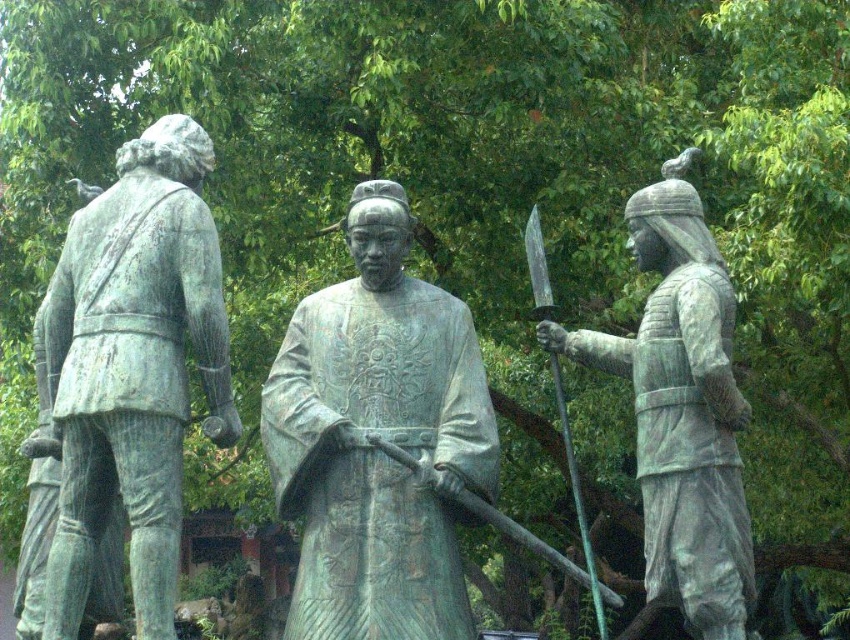
Does green patina statue at center appear on the right side of green patina statue at left?

Correct, you'll find green patina statue at center to the right of green patina statue at left.

Who is lower down, green patina statue at center or green patina statue at left?

green patina statue at center is below.

This screenshot has height=640, width=850. What do you see at coordinates (381, 436) in the screenshot?
I see `green patina statue at center` at bounding box center [381, 436].

At what (x,y) coordinates should I click in order to perform the action: click on green patina statue at center. Please return your answer as a coordinate pair (x, y). The height and width of the screenshot is (640, 850). Looking at the image, I should click on (381, 436).

Based on the photo, between green patina statue at left and polished steel sword at center right, which one appears on the right side from the viewer's perspective?

polished steel sword at center right

Between point (179, 154) and point (599, 625), which one is positioned in front?

Point (179, 154) is more forward.

You are a GUI agent. You are given a task and a screenshot of the screen. Output one action in this format:
    pyautogui.click(x=<x>, y=<y>)
    Task: Click on the green patina statue at left
    
    Given the screenshot: What is the action you would take?
    pyautogui.click(x=132, y=369)

In the scene shown: Who is positioned more to the left, green patina statue at center or polished steel sword at center right?

From the viewer's perspective, green patina statue at center appears more on the left side.

Which is below, green patina statue at center or polished steel sword at center right?

Positioned lower is polished steel sword at center right.

Who is more forward, (326, 467) or (595, 592)?

Point (595, 592) is more forward.

Where is `green patina statue at center`? The width and height of the screenshot is (850, 640). green patina statue at center is located at coordinates (381, 436).